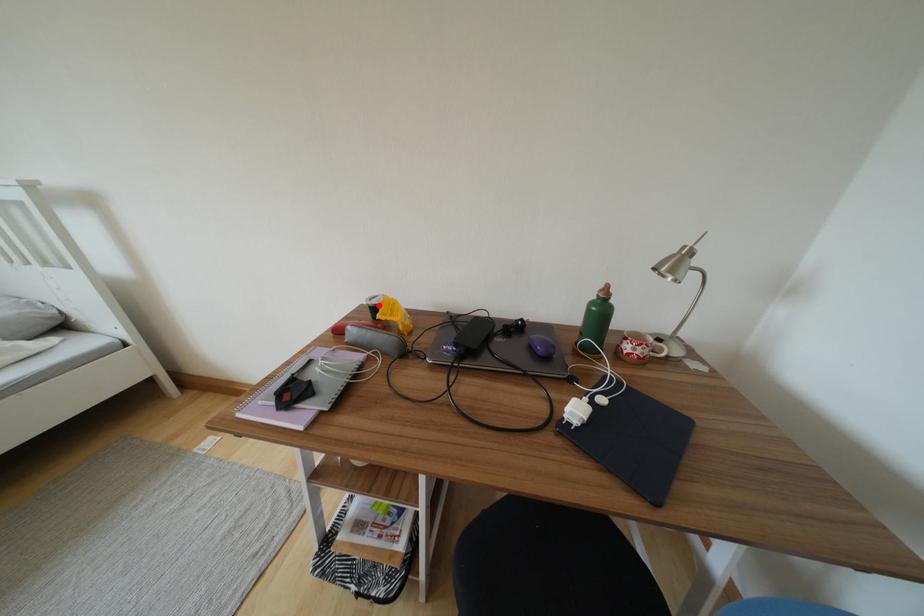
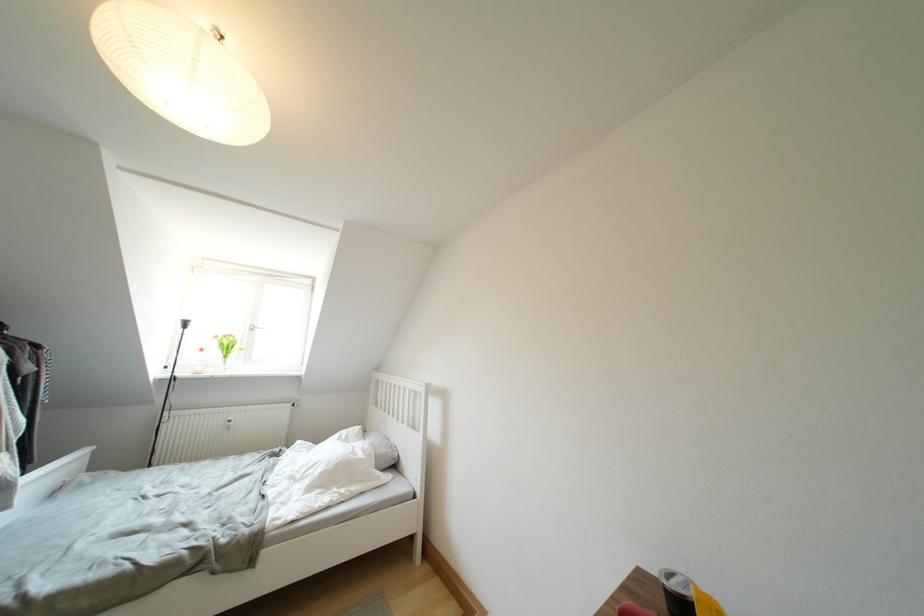
The point at the highlighted location is marked in the first image. Where is the corresponding point in the second image?

(678, 589)